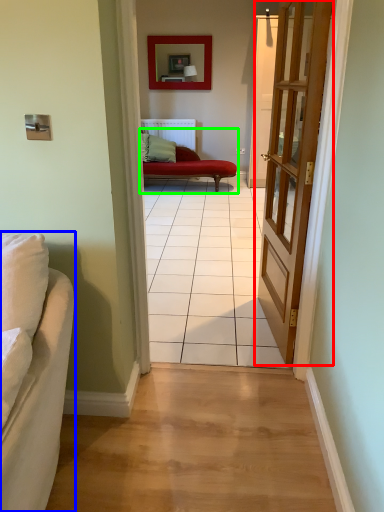
Question: Which object is positioned farthest from door (highlighted by a red box)? Select from studio couch (highlighted by a blue box) and studio couch (highlighted by a green box).

Choices:
 (A) studio couch
 (B) studio couch

Answer: (B)